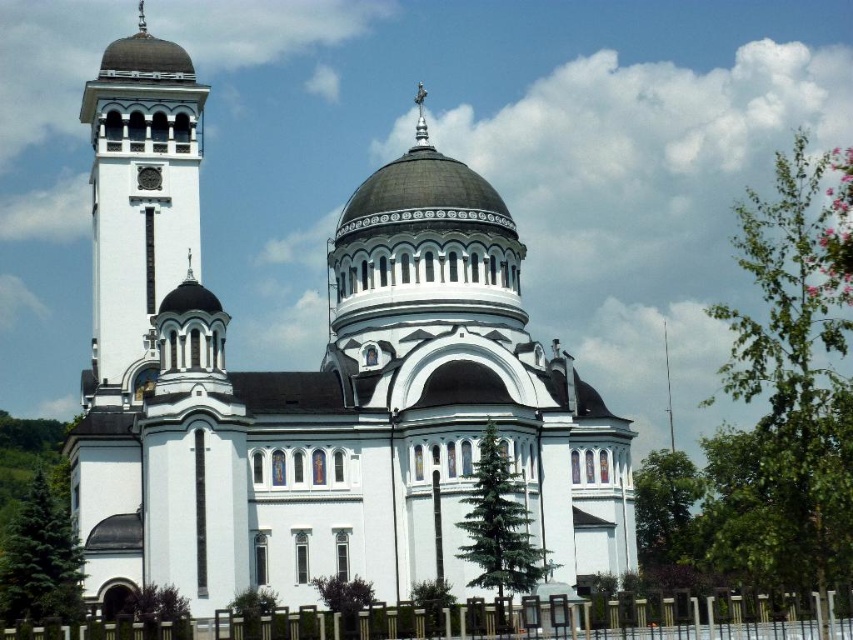
Does point (282, 550) come behind point (738, 604)?

Yes.

Describe the element at coordinates (316, 381) in the screenshot. I see `white stone church at center` at that location.

Who is more distant from viewer, (492, 292) or (590, 611)?

Point (492, 292)

You are a GUI agent. You are given a task and a screenshot of the screen. Output one action in this format:
    pyautogui.click(x=<x>, y=<y>)
    Task: Click on the white stone church at center
    Image resolution: width=853 pixels, height=640 pixels.
    Given the screenshot: What is the action you would take?
    pyautogui.click(x=316, y=381)

Who is lower down, white stone tower at left or white metal fence at lower center?

white metal fence at lower center

Does white stone tower at left appear on the left side of white metal fence at lower center?

Indeed, white stone tower at left is positioned on the left side of white metal fence at lower center.

Find the location of a particular element. The image size is (853, 640). white stone tower at left is located at coordinates (138, 195).

Is point (329, 477) closer to camera compared to point (161, 202)?

Yes, it is.

The height and width of the screenshot is (640, 853). Describe the element at coordinates (316, 381) in the screenshot. I see `white stone church at center` at that location.

Is point (175, 372) positioned before point (119, 364)?

Yes, it is.

Where is `white stone church at center`? The height and width of the screenshot is (640, 853). white stone church at center is located at coordinates (316, 381).